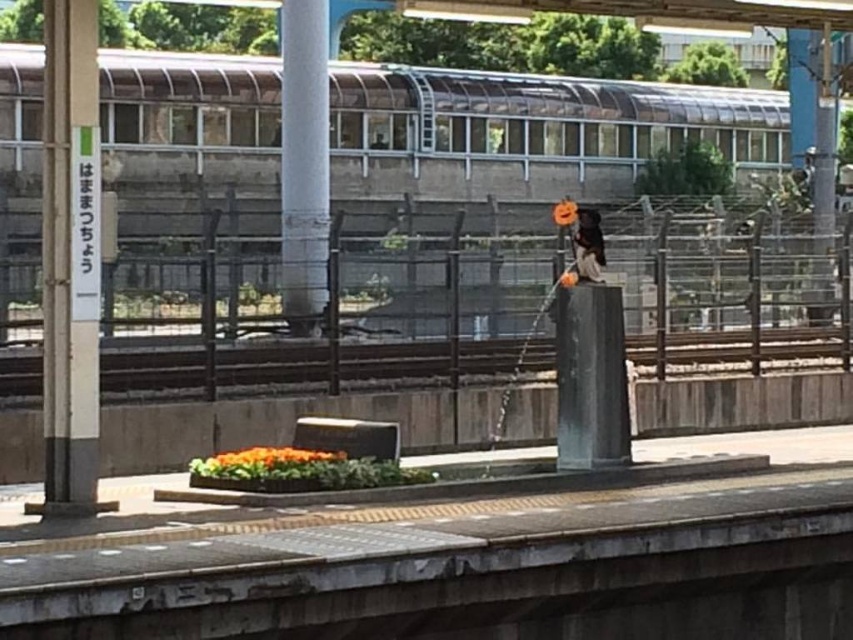
Who is positioned more to the left, metallic silver train at upper center or black polished stone pillar at center?

metallic silver train at upper center

Does point (16, 163) come farther from viewer compared to point (560, 355)?

Yes, it is behind point (560, 355).

Image resolution: width=853 pixels, height=640 pixels. What are the coordinates of `metallic silver train at upper center` in the screenshot? It's located at (535, 125).

Is metallic silver train at upper center smaller than white painted metal pole at left?

No, metallic silver train at upper center is not smaller than white painted metal pole at left.

Is metallic silver train at upper center taller than white painted metal pole at left?

Indeed, metallic silver train at upper center has a greater height compared to white painted metal pole at left.

Who is more distant from viewer, (575, 81) or (68, 13)?

Point (575, 81)

Image resolution: width=853 pixels, height=640 pixels. I want to click on metallic silver train at upper center, so click(x=535, y=125).

Is the position of white painted metal pole at left more distant than that of smooth concrete pole at center?

No, white painted metal pole at left is in front of smooth concrete pole at center.

Which of these two, white painted metal pole at left or smooth concrete pole at center, stands shorter?

white painted metal pole at left

Is point (86, 115) positioned behind point (294, 145)?

No, (86, 115) is in front of (294, 145).

Identify the location of white painted metal pole at left. (67, 266).